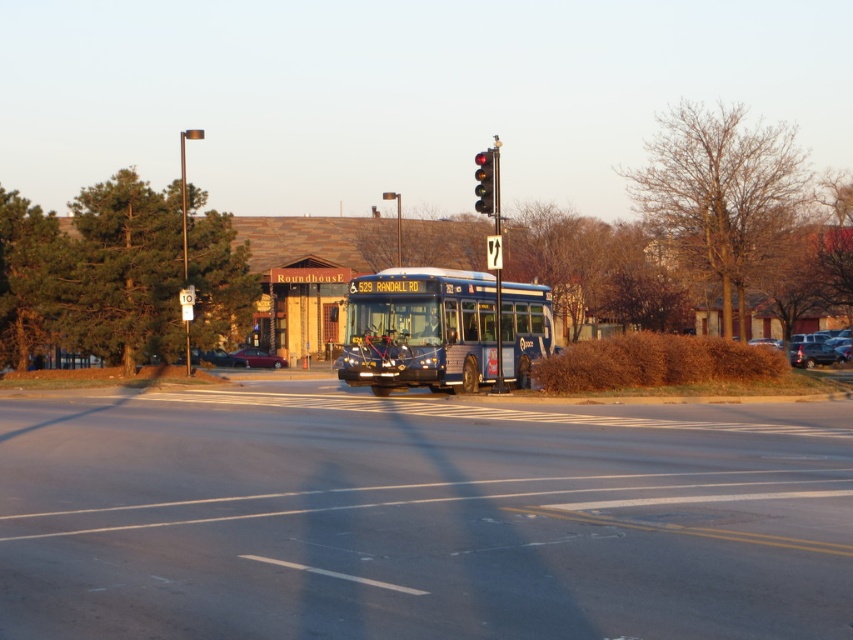
Does blue metallic bus at center appear on the left side of matte black suv at right?

Indeed, blue metallic bus at center is positioned on the left side of matte black suv at right.

You are a GUI agent. You are given a task and a screenshot of the screen. Output one action in this format:
    pyautogui.click(x=<x>, y=<y>)
    Task: Click on the blue metallic bus at center
    
    Given the screenshot: What is the action you would take?
    pyautogui.click(x=421, y=330)

You are a GUI agent. You are given a task and a screenshot of the screen. Output one action in this format:
    pyautogui.click(x=<x>, y=<y>)
    Task: Click on the blue metallic bus at center
    
    Given the screenshot: What is the action you would take?
    pyautogui.click(x=421, y=330)

Locate an element on the screen. matte black suv at right is located at coordinates (810, 348).

Is matte black suv at right to the left of metallic silver sedan at center-right from the viewer's perspective?

No, matte black suv at right is not to the left of metallic silver sedan at center-right.

At what (x,y) coordinates should I click in order to perform the action: click on matte black suv at right. Please return your answer as a coordinate pair (x, y). The height and width of the screenshot is (640, 853). Looking at the image, I should click on (810, 348).

Find the location of a particular element. matte black suv at right is located at coordinates (810, 348).

Who is positioned more to the right, black rubber road at center or metallic silver sedan at center-right?

metallic silver sedan at center-right is more to the right.

This screenshot has height=640, width=853. In order to click on black rubber road at center in this screenshot , I will do `click(421, 518)`.